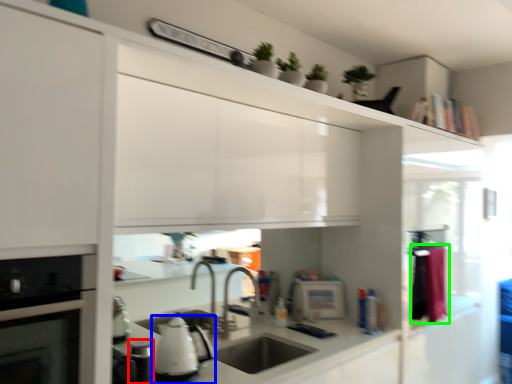
Question: Which is nearer to the appliance (highlighted by a red box)? kitchen appliance (highlighted by a blue box) or laundry (highlighted by a green box).

Choices:
 (A) kitchen appliance
 (B) laundry

Answer: (A)